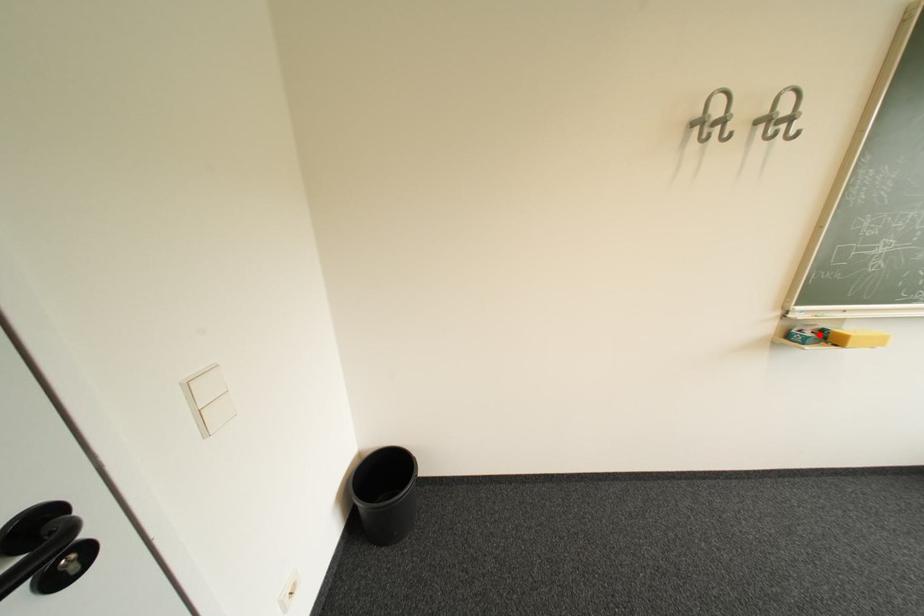
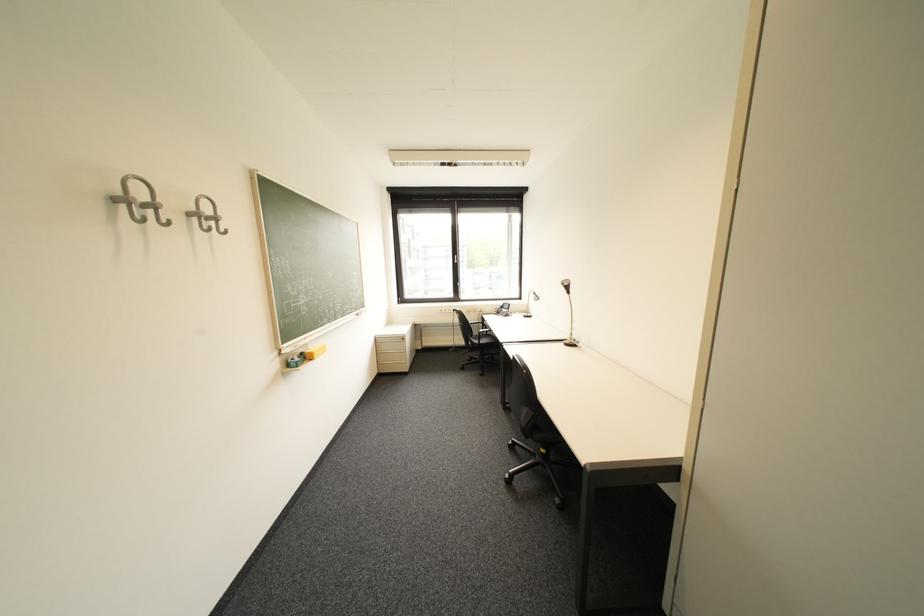
Where in the second image is the point corresponding to the highlighted location from the first image?

(308, 360)